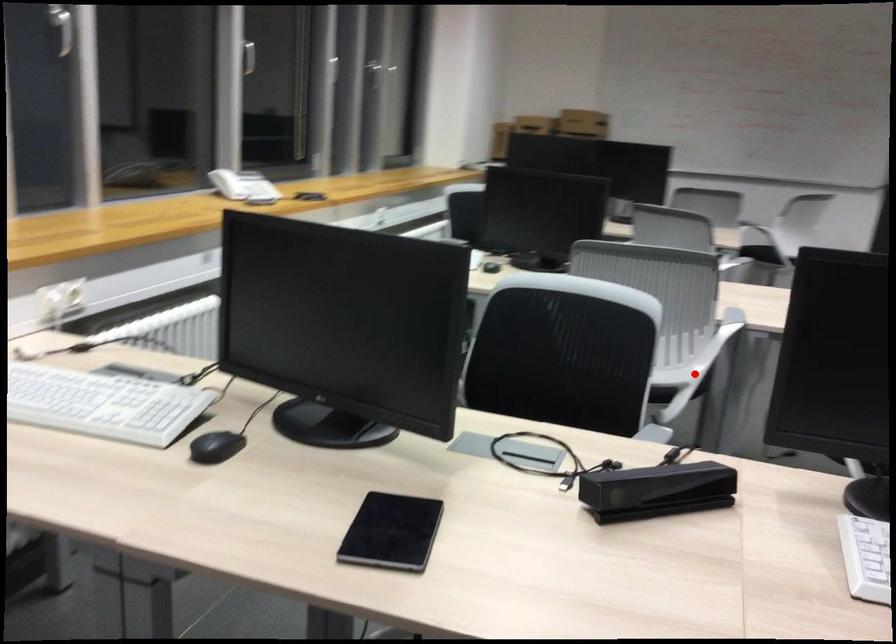
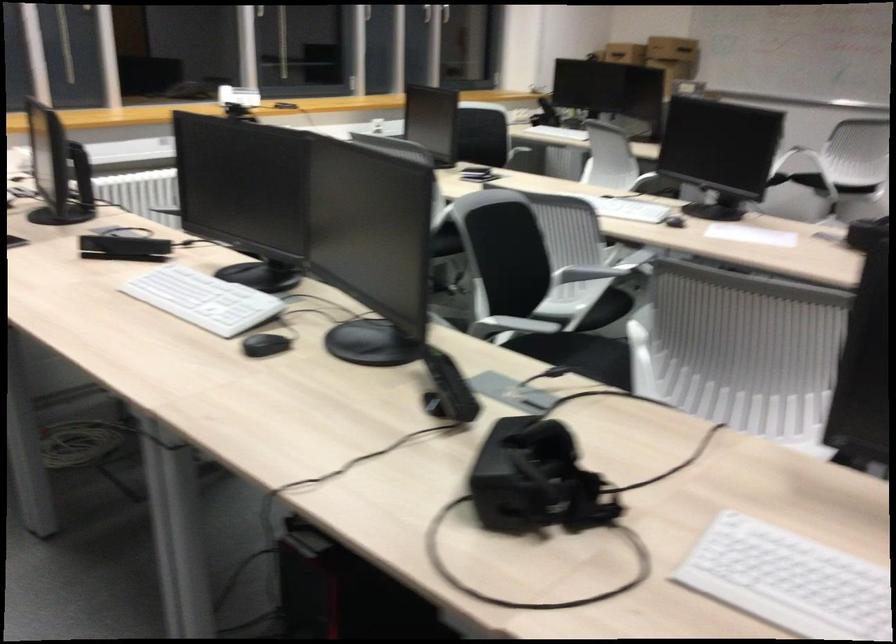
In the second image, find the point that corresponds to the highlighted location in the first image.

(445, 242)